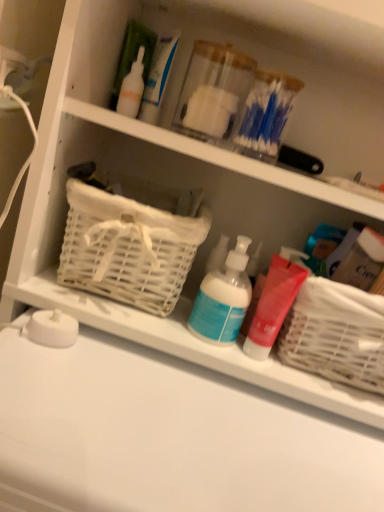
You are a GUI agent. You are given a task and a screenshot of the screen. Output one action in this format:
    pyautogui.click(x=<x>, y=<y>)
    Task: Click on the vacant space positioned to the left of matte red pump bottle at center, which ranks as the 1th cleaning product in right-to-left order
    This screenshot has height=512, width=384.
    Given the screenshot: What is the action you would take?
    pyautogui.click(x=121, y=362)